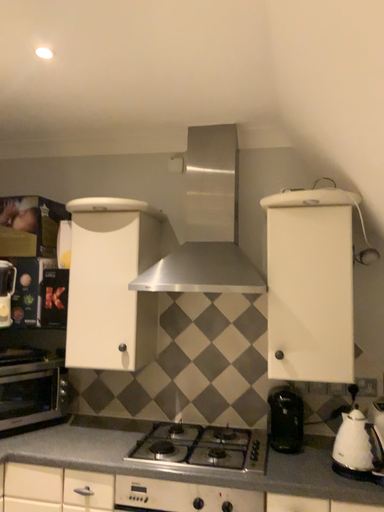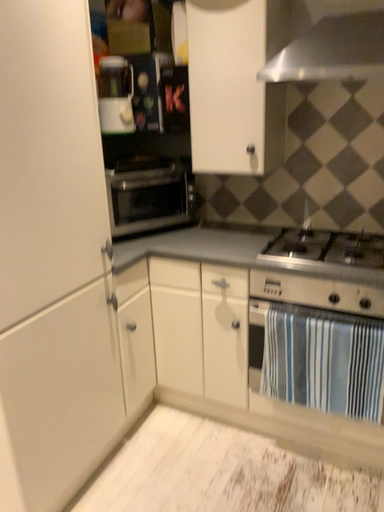
Question: Which way did the camera rotate in the video?

Choices:
 (A) rotated left
 (B) rotated right

Answer: (A)